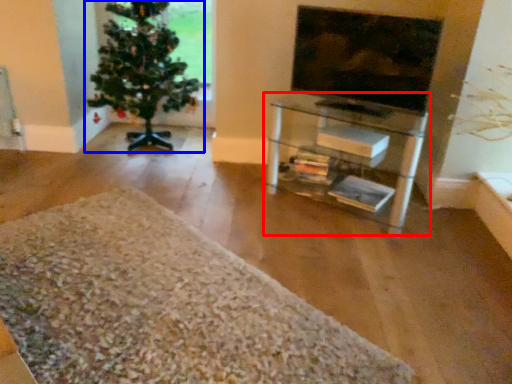
Question: Which object is closer to the camera taking this photo, shelf (highlighted by a red box) or houseplant (highlighted by a blue box)?

Choices:
 (A) shelf
 (B) houseplant

Answer: (A)